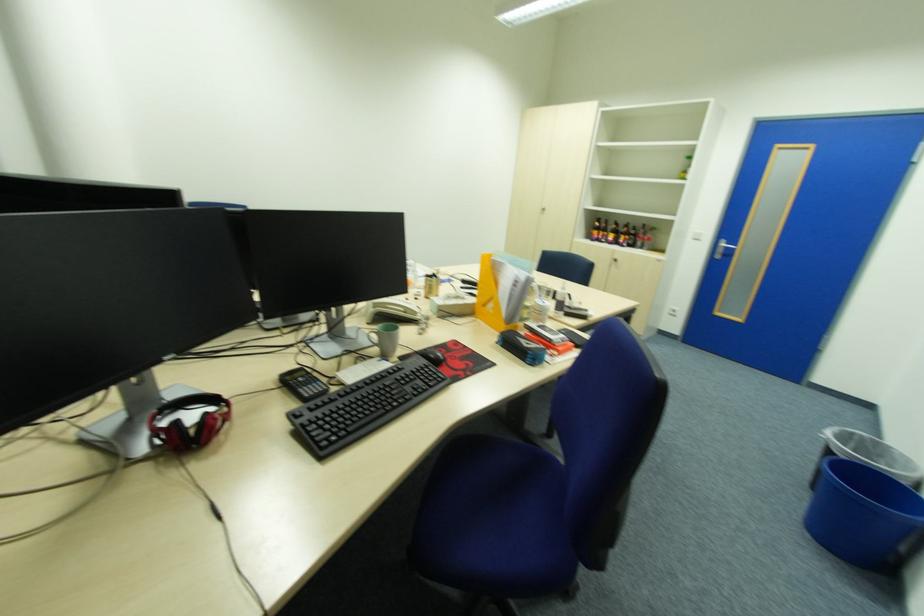
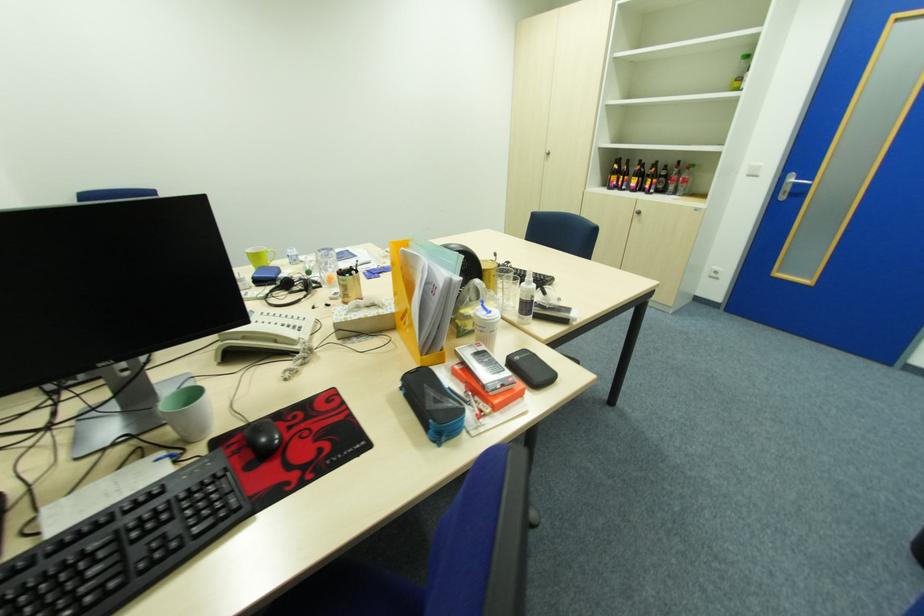
Which direction would the cameraman need to move to produce the second image?

The movement direction of the cameraman is right, forward.